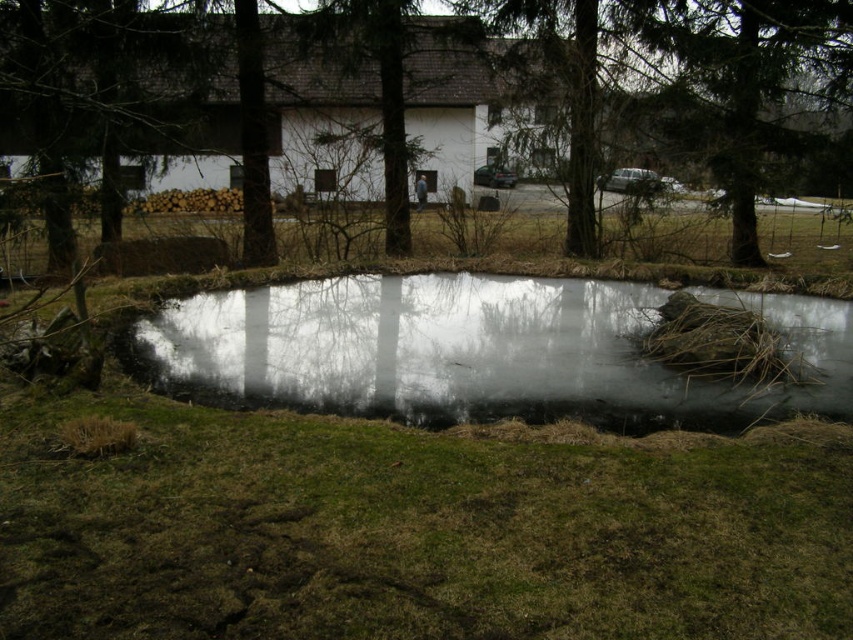
You are planning to take a photo of the brown textured tree at center and the transparent ice at center. Which object should you focus on first if you want to capture both in a single frame without moving the camera?

The brown textured tree at center is larger in size than transparent ice at center, so you should focus on the brown textured tree at center first to ensure it fills the frame appropriately before adjusting for the smaller transparent ice at center.

You are standing at the center of the pond and want to walk to the brown textured tree at center. Given that the ice on the pond is safe to walk on, which direction should you head in?

The brown textured tree at center is located at point 0.150 on the x axis and 0.736 on the y axis. Since you are at the center of the pond, you should head towards the direction of the lower left to reach the brown textured tree at center.

You are standing at the edge of the pond and want to compare the height of the brown textured tree at center and the transparent ice at center. Which one is taller?

The brown textured tree at center is taller than the transparent ice at center.